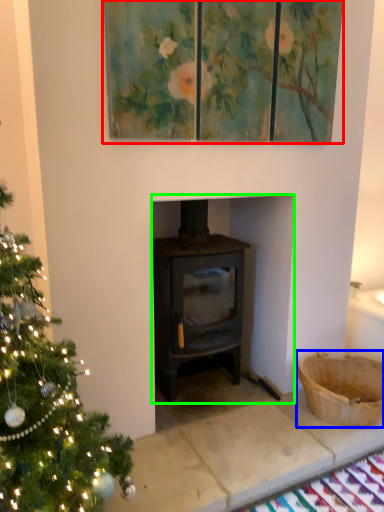
Question: Which object is positioned closest to oil painting (highlighted by a red box)? Select from basket (highlighted by a blue box) and fireplace (highlighted by a green box).

Choices:
 (A) basket
 (B) fireplace

Answer: (B)